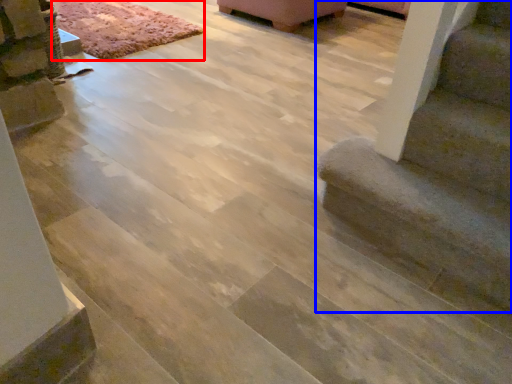
Question: Among these objects, which one is nearest to the camera, mat (highlighted by a red box) or stairs (highlighted by a blue box)?

Choices:
 (A) mat
 (B) stairs

Answer: (B)